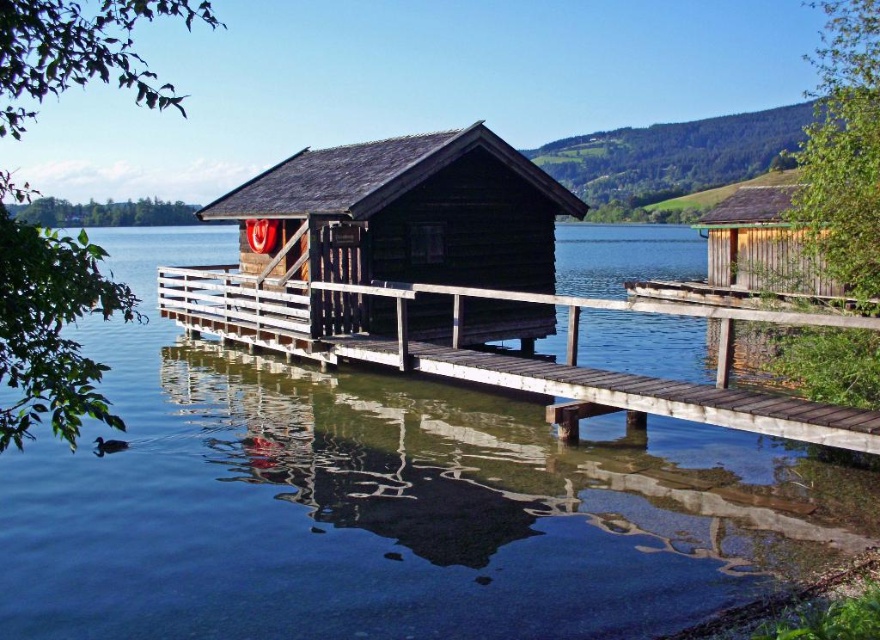
Based on the photo, you are standing on the dock and want to retrieve a floating object located at the transparent water at dock center. If your reach extends 1.5 meters, can you reach it?

The transparent water at dock center is 6.10 meters away from you, so no, you cannot reach it with a 1.5 meter reach.

You are standing on the wooden dock at center and want to reach the wooden cabin at right. Based on the scene description, which direction should you move to get there?

The wooden dock at center is located below the wooden cabin at right, so you should move upward towards the wooden cabin at right to reach it.

You are standing on the dock and want to retrieve the red lifebuoy hanging from the wooden cabin at right. However, there is transparent water at dock center between you and the cabin. Can you reach the cabin without stepping into the water?

The transparent water at dock center is closer to the viewer than the wooden cabin at right, so the cabin is behind the water. To reach the cabin, you would need to step around or over the water area, but since it is water, you cannot walk through it. Therefore, you cannot reach the cabin without stepping into the water.